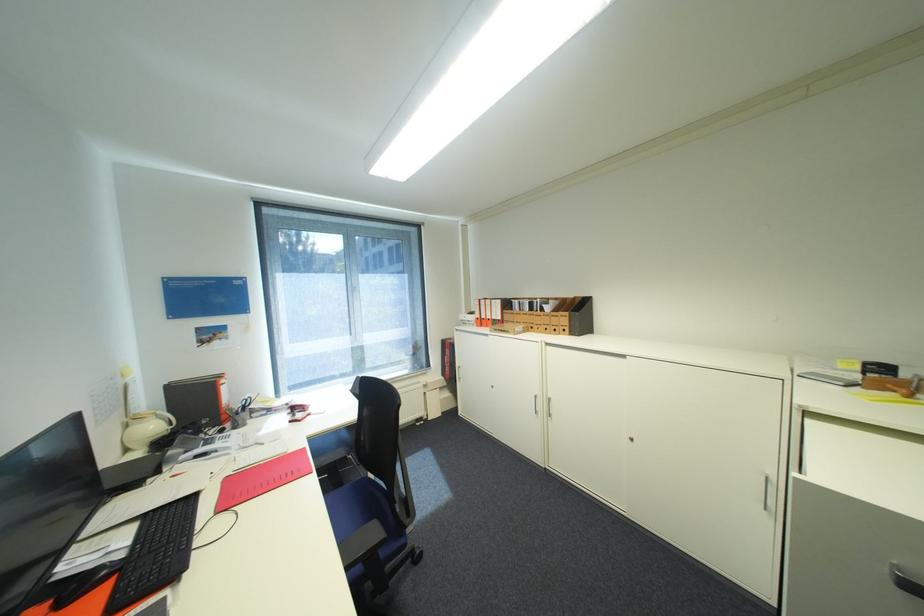
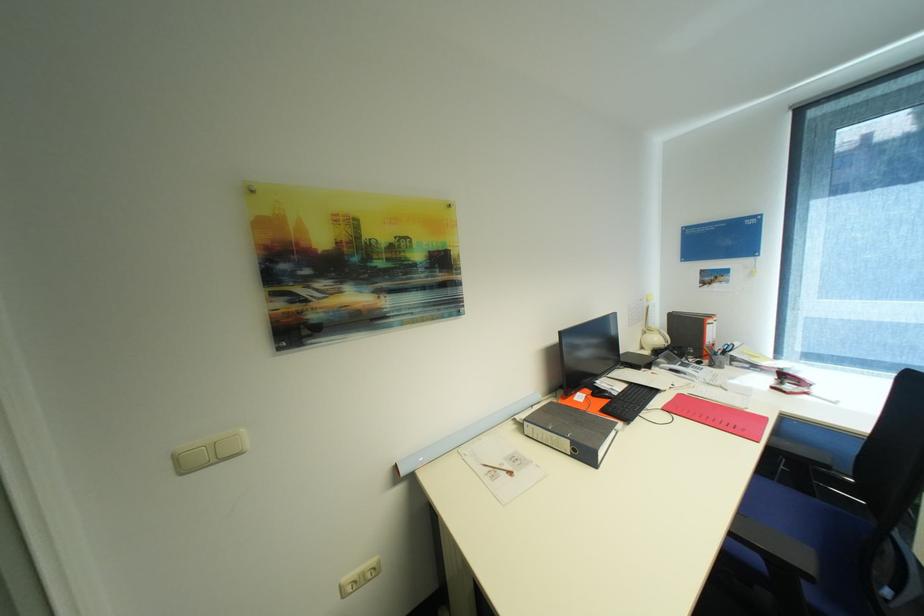
The point at (225,514) is marked in the first image. Where is the corresponding point in the second image?

(671, 410)